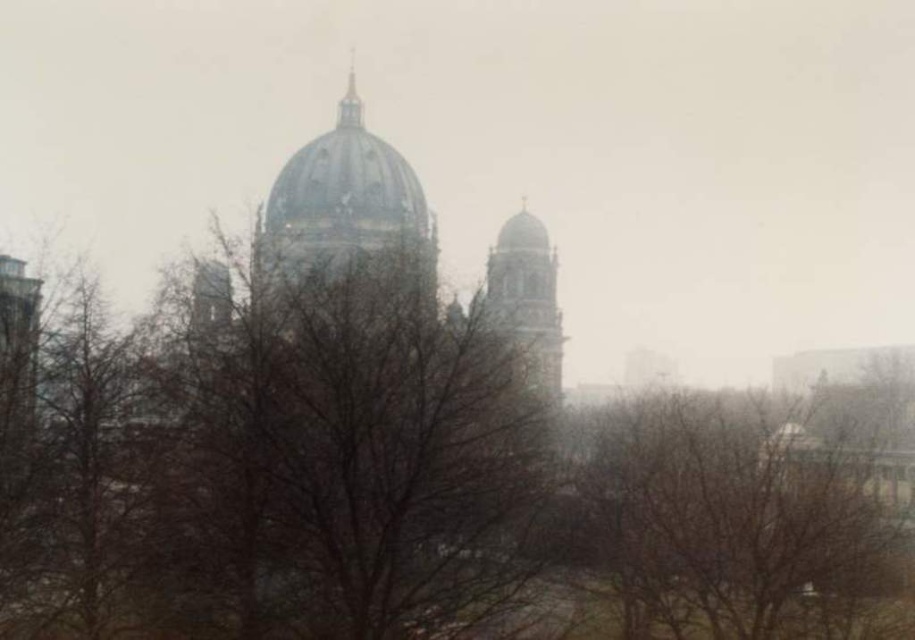
Is brown leafless branches at center taller than brown leafless tree at center?

Correct, brown leafless branches at center is much taller as brown leafless tree at center.

Is point (432, 496) positioned after point (653, 512)?

No, it is not.

The height and width of the screenshot is (640, 915). I want to click on brown leafless branches at center, so click(404, 492).

Locate an element on the screen. Image resolution: width=915 pixels, height=640 pixels. brown leafless branches at center is located at coordinates (404, 492).

Who is taller, gold domed tower at center or gold metallic spire at upper center?

gold domed tower at center is taller.

Does gold domed tower at center appear on the right side of gold metallic spire at upper center?

Indeed, gold domed tower at center is positioned on the right side of gold metallic spire at upper center.

Where is `gold domed tower at center`? The height and width of the screenshot is (640, 915). gold domed tower at center is located at coordinates (348, 218).

Does point (281, 426) lie in front of point (518, 342)?

Yes, point (281, 426) is in front of point (518, 342).

Between brown leafless branches at center and smooth stone tower at center, which one has more height?

Standing taller between the two is brown leafless branches at center.

What do you see at coordinates (404, 492) in the screenshot?
I see `brown leafless branches at center` at bounding box center [404, 492].

This screenshot has width=915, height=640. I want to click on brown leafless branches at center, so 404,492.